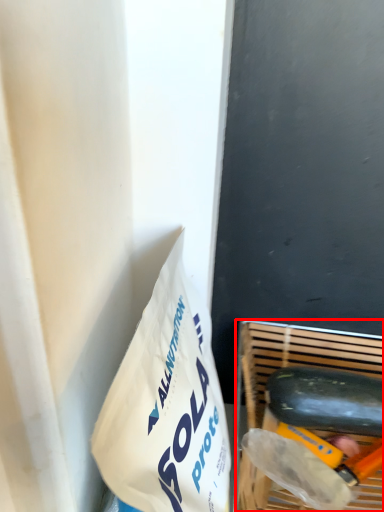
Question: From the image, what is the correct spatial relationship of basket (annotated by the red box) in relation to cucumber?

Choices:
 (A) right
 (B) left

Answer: (B)